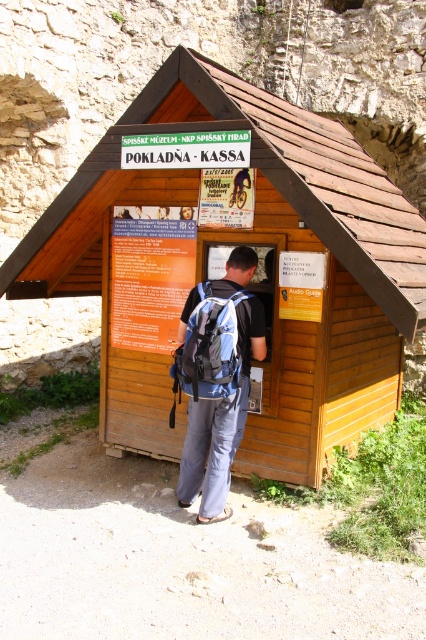
You are a tourist standing in front of the wooden cabin at center and the blue fabric backpack at center. You want to know which object is wider. Which one is wider?

The wooden cabin at center is wider than the blue fabric backpack at center.